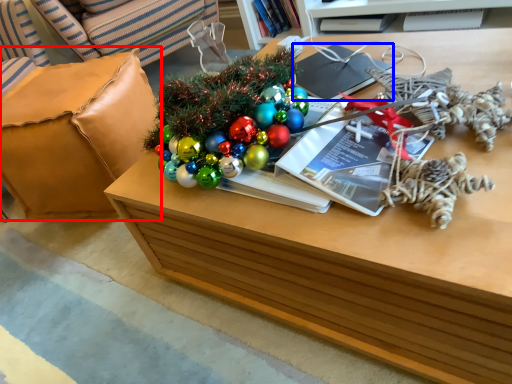
Question: Which point is further to the camera, armchair (highlighted by a red box) or magazine (highlighted by a blue box)?

Choices:
 (A) armchair
 (B) magazine

Answer: (A)